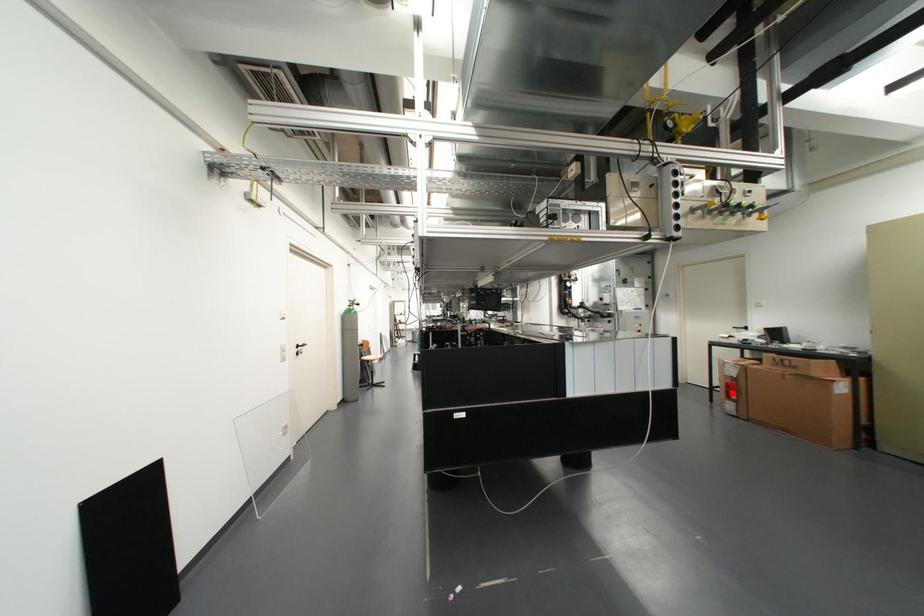
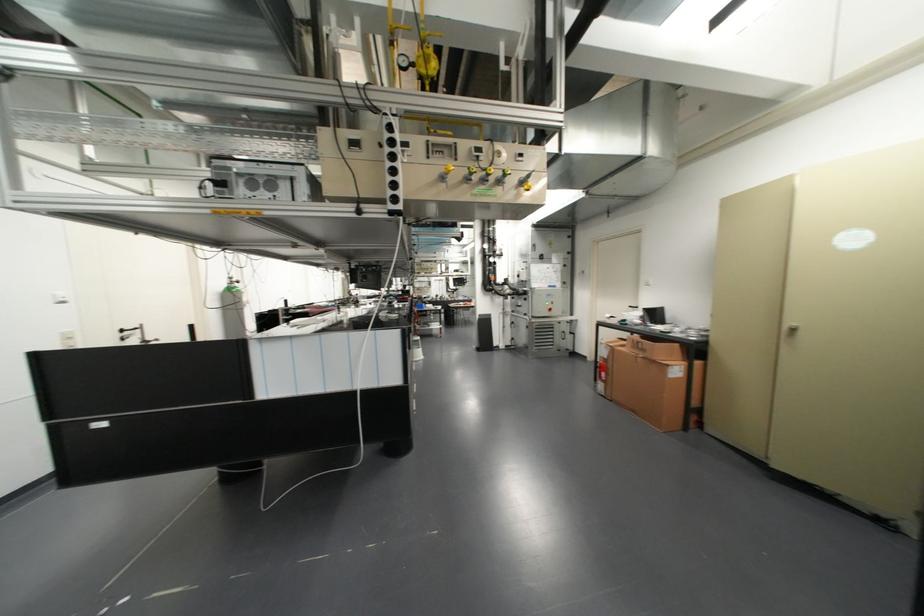
In the second image, find the point that corresponds to the highlighted location in the first image.

(602, 374)